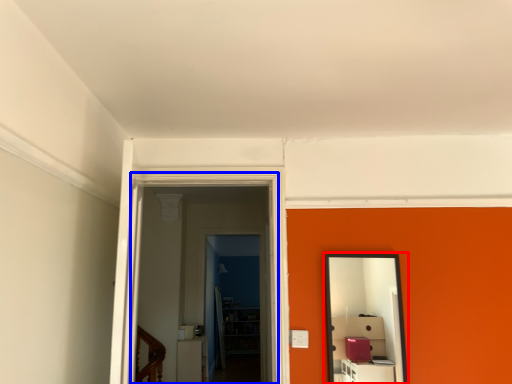
Question: Which object is further to the camera taking this photo, mirror (highlighted by a red box) or glass door (highlighted by a blue box)?

Choices:
 (A) mirror
 (B) glass door

Answer: (A)